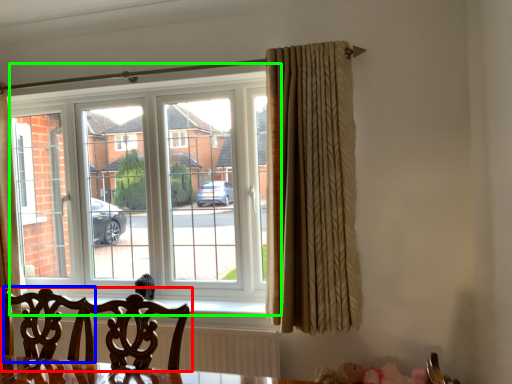
Question: Estimate the real-world distances between objects in this image. Which object is farther from chair (highlighted by a red box), swivel chair (highlighted by a blue box) or window (highlighted by a green box)?

Choices:
 (A) swivel chair
 (B) window

Answer: (B)